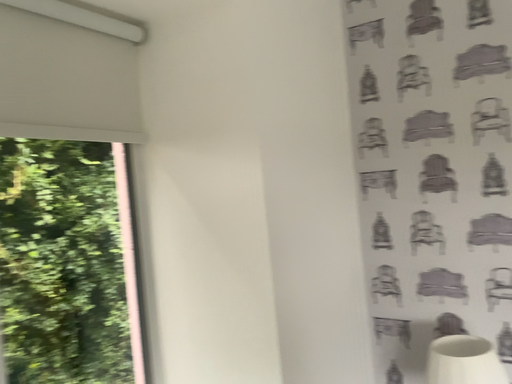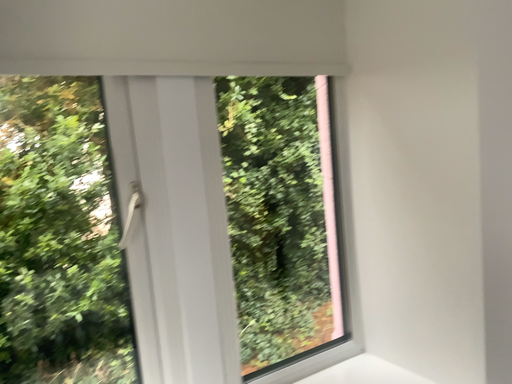
Question: How did the camera likely rotate when shooting the video?

Choices:
 (A) rotated upward
 (B) rotated downward

Answer: (B)